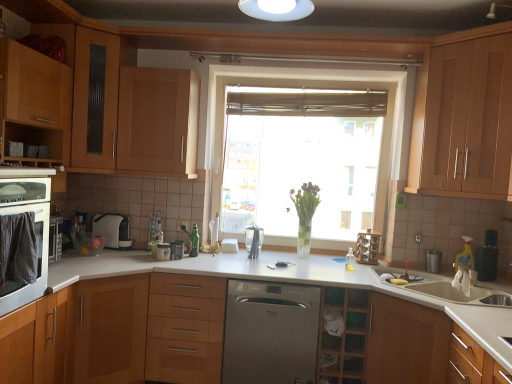
The width and height of the screenshot is (512, 384). In order to click on free location to the right of green plastic faucet at center in this screenshot , I will do `click(212, 258)`.